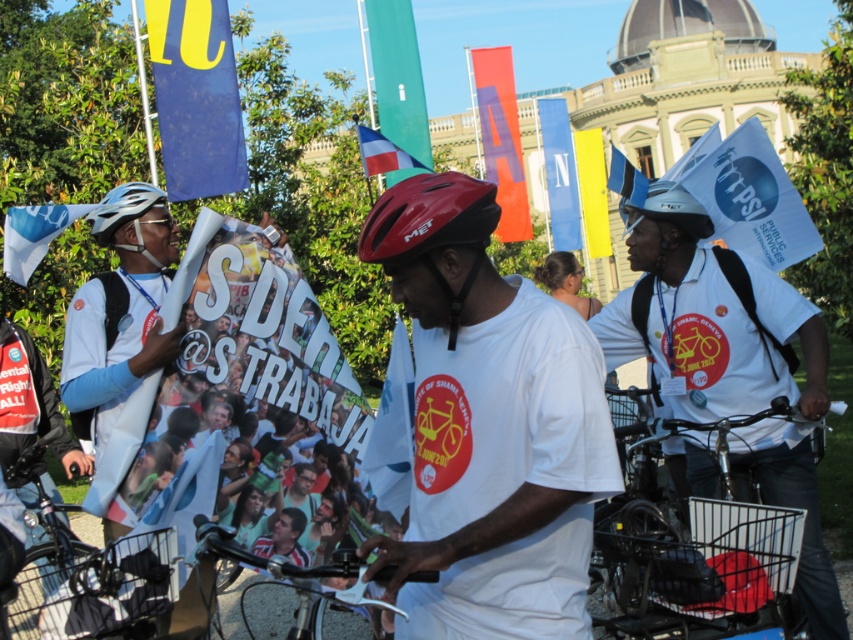
Question: In this image, where is blue fabric flag at upper left located relative to shiny silver helmet at left?

Choices:
 (A) left
 (B) right

Answer: (B)

Question: Which point appears farthest from the camera in this image?

Choices:
 (A) (534, 289)
 (B) (677, 227)
 (C) (35, 220)

Answer: (C)

Question: Which is nearer to the blue fabric flag at left?

Choices:
 (A) white paper poster at center
 (B) white matte t-shirt at center
 (C) blue fabric flag at upper left
 (D) matte blue helmet at left

Answer: (D)

Question: Does black matte bicycle at lower left have a greater width compared to blue fabric flag at left?

Choices:
 (A) no
 (B) yes

Answer: (A)

Question: In this image, where is green fabric flag at upper center located relative to blue fabric flag at left?

Choices:
 (A) right
 (B) left

Answer: (A)

Question: Which object appears farthest from the camera in this image?

Choices:
 (A) blue fabric flag at center
 (B) white matte t-shirt at center
 (C) matte blue helmet at left

Answer: (A)